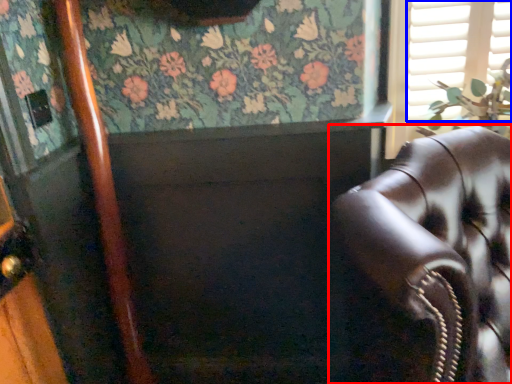
Question: Which object is closer to the camera taking this photo, chair (highlighted by a red box) or shutter (highlighted by a blue box)?

Choices:
 (A) chair
 (B) shutter

Answer: (A)